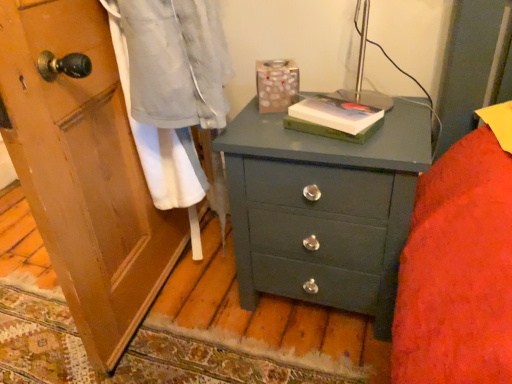
Describe the element at coordinates (324, 209) in the screenshot. I see `matte green chest of drawers at center` at that location.

Where is `hardcover book at center, marked as the 1th book in a bottom-to-top arrangement`? This screenshot has height=384, width=512. hardcover book at center, marked as the 1th book in a bottom-to-top arrangement is located at coordinates (331, 130).

From the image's perspective, is hardcover book at center, marked as the 1th book in a bottom-to-top arrangement, over matte green chest of drawers at center?

Yes, from the image's perspective, hardcover book at center, marked as the 1th book in a bottom-to-top arrangement, is on top of matte green chest of drawers at center.

From a real-world perspective, is hardcover book at center, marked as the 1th book in a bottom-to-top arrangement, on matte green chest of drawers at center?

Yes, from a real-world perspective, hardcover book at center, marked as the 1th book in a bottom-to-top arrangement, is over matte green chest of drawers at center

Is point (318, 135) positioned after point (292, 221)?

No, it is in front of (292, 221).

Does hardcover book at center, marked as the 1th book in a bottom-to-top arrangement, appear on the left side of matte green chest of drawers at center?

Correct, you'll find hardcover book at center, marked as the 1th book in a bottom-to-top arrangement, to the left of matte green chest of drawers at center.

Does point (333, 135) lie in front of point (304, 113)?

Yes, point (333, 135) is in front of point (304, 113).

How many degrees apart are the facing directions of hardcover book at center, marked as the second book in a top-to-bottom arrangement, and hardcover book at center, which is the 2th book from bottom to top?

The angular difference between hardcover book at center, marked as the second book in a top-to-bottom arrangement, and hardcover book at center, which is the 2th book from bottom to top, is 9.19 degrees.

From the image's perspective, which one is positioned higher, hardcover book at center, marked as the 1th book in a bottom-to-top arrangement, or hardcover book at center, which is the 2th book from bottom to top?

hardcover book at center, which is the 2th book from bottom to top, is shown above in the image.

This screenshot has width=512, height=384. Find the location of `book positioned vertically above the hardcover book at center, marked as the 1th book in a bottom-to-top arrangement (from a real-world perspective)`. book positioned vertically above the hardcover book at center, marked as the 1th book in a bottom-to-top arrangement (from a real-world perspective) is located at coordinates (332, 117).

Considering the points (368, 124) and (341, 211), which point is behind, point (368, 124) or point (341, 211)?

The point (341, 211) is behind.

From the image's perspective, which one is positioned lower, hardcover book at center, acting as the 1th book starting from the top, or matte green chest of drawers at center?

matte green chest of drawers at center, from the image's perspective.

In order to click on chest of drawers located on the right of hardcover book at center, which is the 2th book from bottom to top in this screenshot , I will do `click(324, 209)`.

Considering the sizes of objects hardcover book at center, which is the 2th book from bottom to top, and matte green chest of drawers at center in the image provided, who is taller, hardcover book at center, which is the 2th book from bottom to top, or matte green chest of drawers at center?

matte green chest of drawers at center.

Could you measure the distance between matte green chest of drawers at center and hardcover book at center, marked as the 1th book in a bottom-to-top arrangement?

matte green chest of drawers at center is 23.05 centimeters away from hardcover book at center, marked as the 1th book in a bottom-to-top arrangement.

Looking at their sizes, would you say matte green chest of drawers at center is wider or thinner than hardcover book at center, marked as the 1th book in a bottom-to-top arrangement?

Clearly, matte green chest of drawers at center has more width compared to hardcover book at center, marked as the 1th book in a bottom-to-top arrangement.

Could you tell me if matte green chest of drawers at center is facing hardcover book at center, marked as the 1th book in a bottom-to-top arrangement?

No, matte green chest of drawers at center is not oriented towards hardcover book at center, marked as the 1th book in a bottom-to-top arrangement.

Which is in front, matte green chest of drawers at center or hardcover book at center, marked as the 1th book in a bottom-to-top arrangement?

matte green chest of drawers at center is closer to the camera.

Consider the image. Is matte green chest of drawers at center not near hardcover book at center, which is the 2th book from bottom to top?

They are positioned close to each other.

Between point (404, 223) and point (358, 114), which one is positioned behind?

The point (404, 223) is farther.

Could you tell me if matte green chest of drawers at center is turned towards hardcover book at center, acting as the 1th book starting from the top?

No, matte green chest of drawers at center does not turn towards hardcover book at center, acting as the 1th book starting from the top.

From the image's perspective, is matte green chest of drawers at center located above hardcover book at center, which is the 2th book from bottom to top?

Actually, matte green chest of drawers at center appears below hardcover book at center, which is the 2th book from bottom to top, in the image.

This screenshot has height=384, width=512. Find the location of `book below the hardcover book at center, acting as the 1th book starting from the top (from the image's perspective)`. book below the hardcover book at center, acting as the 1th book starting from the top (from the image's perspective) is located at coordinates [331, 130].

Could you tell me if hardcover book at center, acting as the 1th book starting from the top, is turned towards hardcover book at center, marked as the second book in a top-to-bottom arrangement?

No, hardcover book at center, acting as the 1th book starting from the top, is not turned towards hardcover book at center, marked as the second book in a top-to-bottom arrangement.

Is hardcover book at center, which is the 2th book from bottom to top, situated inside hardcover book at center, marked as the second book in a top-to-bottom arrangement, or outside?

hardcover book at center, which is the 2th book from bottom to top, is not inside hardcover book at center, marked as the second book in a top-to-bottom arrangement, it's outside.

From the image's perspective, is hardcover book at center, which is the 2th book from bottom to top, located above or below hardcover book at center, marked as the second book in a top-to-bottom arrangement?

Clearly, from the image's perspective, hardcover book at center, which is the 2th book from bottom to top, is above hardcover book at center, marked as the second book in a top-to-bottom arrangement.

This screenshot has width=512, height=384. Find the location of `the chest of drawers in front of the hardcover book at center, marked as the 1th book in a bottom-to-top arrangement`. the chest of drawers in front of the hardcover book at center, marked as the 1th book in a bottom-to-top arrangement is located at coordinates (324, 209).

There is a hardcover book at center, marked as the 1th book in a bottom-to-top arrangement. Where is `book above it (from a real-world perspective)`? book above it (from a real-world perspective) is located at coordinates (332, 117).

Which object lies nearer to the anchor point hardcover book at center, marked as the second book in a top-to-bottom arrangement, matte green chest of drawers at center or hardcover book at center, which is the 2th book from bottom to top?

hardcover book at center, which is the 2th book from bottom to top, is positioned closer to the anchor hardcover book at center, marked as the second book in a top-to-bottom arrangement.

From the picture: From the image, which object appears to be farther from matte green chest of drawers at center, hardcover book at center, marked as the 1th book in a bottom-to-top arrangement, or hardcover book at center, acting as the 1th book starting from the top?

hardcover book at center, marked as the 1th book in a bottom-to-top arrangement, lies further to matte green chest of drawers at center than the other object.

When comparing their distances from hardcover book at center, which is the 2th book from bottom to top, does hardcover book at center, marked as the second book in a top-to-bottom arrangement, or matte green chest of drawers at center seem further?

matte green chest of drawers at center is positioned further to the anchor hardcover book at center, which is the 2th book from bottom to top.

Considering their positions, is hardcover book at center, acting as the 1th book starting from the top, positioned further to matte green chest of drawers at center than hardcover book at center, marked as the second book in a top-to-bottom arrangement?

hardcover book at center, marked as the second book in a top-to-bottom arrangement, is positioned further to the anchor matte green chest of drawers at center.

Which object lies nearer to the anchor point hardcover book at center, marked as the 1th book in a bottom-to-top arrangement, hardcover book at center, which is the 2th book from bottom to top, or matte green chest of drawers at center?

Based on the image, hardcover book at center, which is the 2th book from bottom to top, appears to be nearer to hardcover book at center, marked as the 1th book in a bottom-to-top arrangement.

Estimate the real-world distances between objects in this image. Which object is further from hardcover book at center, acting as the 1th book starting from the top, matte green chest of drawers at center or hardcover book at center, marked as the 1th book in a bottom-to-top arrangement?

matte green chest of drawers at center.

Find the location of `book that lies between hardcover book at center, acting as the 1th book starting from the top, and matte green chest of drawers at center from top to bottom`. book that lies between hardcover book at center, acting as the 1th book starting from the top, and matte green chest of drawers at center from top to bottom is located at coordinates (331, 130).